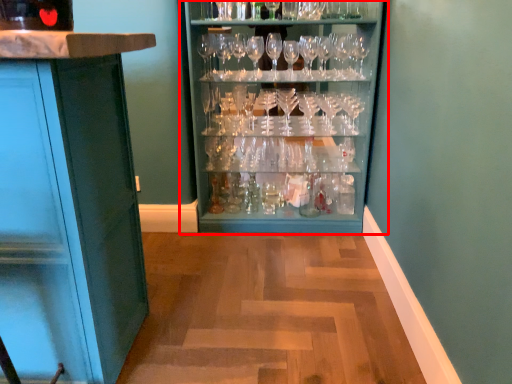
Question: From the image's perspective, where is cupboard (annotated by the red box) located in relation to cabinetry in the image?

Choices:
 (A) below
 (B) above

Answer: (B)